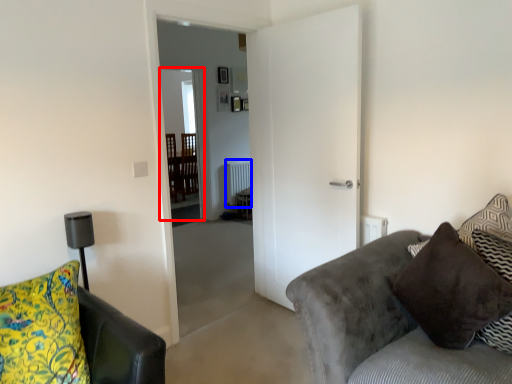
Question: Which object is further to the camera taking this photo, glass door (highlighted by a red box) or radiator (highlighted by a blue box)?

Choices:
 (A) glass door
 (B) radiator

Answer: (B)